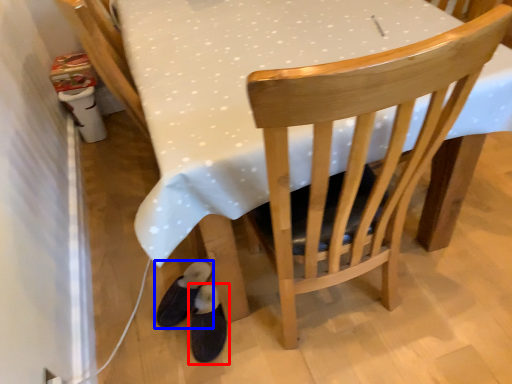
Question: Which object appears farthest to the camera in this image, footwear (highlighted by a red box) or footwear (highlighted by a blue box)?

Choices:
 (A) footwear
 (B) footwear

Answer: (B)